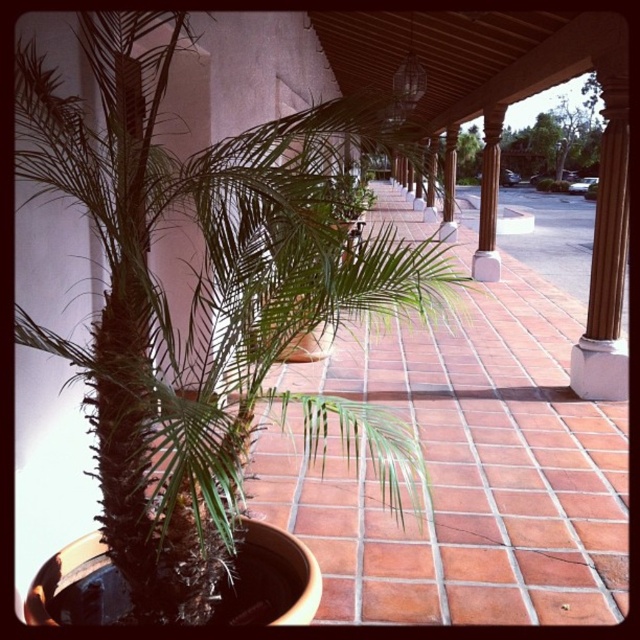
Measure the distance between brown polished wood column at center and camera.

brown polished wood column at center and camera are 8.04 meters apart.

The image size is (640, 640). What do you see at coordinates (488, 198) in the screenshot?
I see `brown polished wood column at center` at bounding box center [488, 198].

Where is `brown polished wood column at center`? The width and height of the screenshot is (640, 640). brown polished wood column at center is located at coordinates (488, 198).

Is green leafy palm at center smaller than brown polished wood column at center?

No.

Is green leafy palm at center in front of brown polished wood column at center?

Yes, green leafy palm at center is closer to the viewer.

Does point (330, 186) come in front of point (490, 253)?

Yes, it is in front of point (490, 253).

Find the location of a particular element. green leafy palm at center is located at coordinates (209, 292).

Can you confirm if green leafy palm at center is taller than green leafy plant at center?

Yes.

Which is more to the left, green leafy palm at center or green leafy plant at center?

Positioned to the left is green leafy palm at center.

The width and height of the screenshot is (640, 640). I want to click on green leafy palm at center, so click(209, 292).